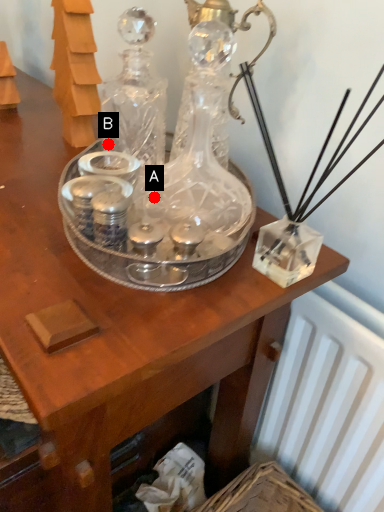
Question: Two points are circled on the image, labeled by A and B beside each circle. Which point appears closest to the camera in this image?

Choices:
 (A) A is closer
 (B) B is closer

Answer: (A)